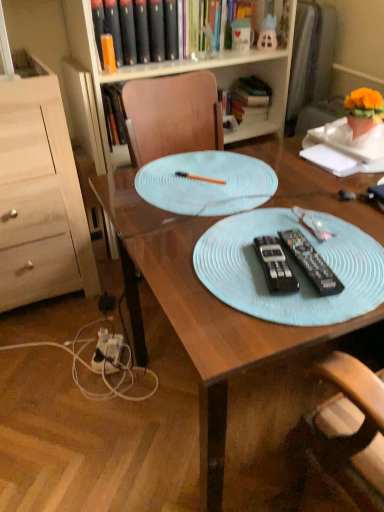
This screenshot has width=384, height=512. What are the coordinates of `free space that is in between light blue textured placemat at upper center and white paper at upper right` in the screenshot? It's located at (297, 167).